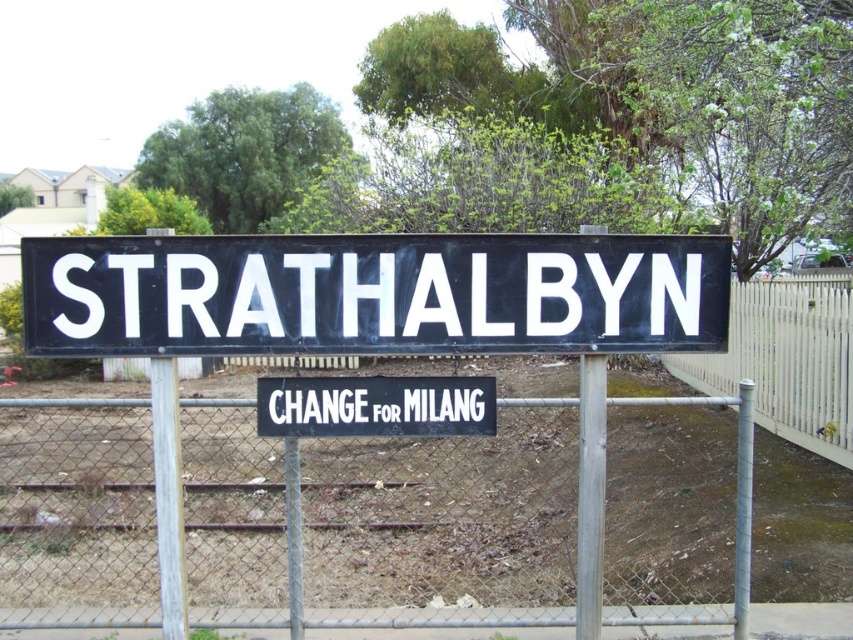
Question: Which of the following is the closest to the observer?

Choices:
 (A) white wood pole at center
 (B) white picket fence at right
 (C) white/black sign at center

Answer: (A)

Question: Which point is farther from the camera taking this photo?

Choices:
 (A) (257, 403)
 (B) (741, 538)
 (C) (595, 602)

Answer: (B)

Question: Can you confirm if white wood pole at center is wider than silver metallic pole at center?

Choices:
 (A) no
 (B) yes

Answer: (B)

Question: Can you confirm if silver metallic pole at right is positioned to the left of metallic chain-link fence at lower center?

Choices:
 (A) yes
 (B) no

Answer: (B)

Question: Which point is farther to the camera?

Choices:
 (A) metallic chain-link fence at lower center
 (B) black matte sign at center

Answer: (A)

Question: Can you confirm if silver metallic pole at center is positioned to the right of silver metallic pole at right?

Choices:
 (A) yes
 (B) no

Answer: (B)